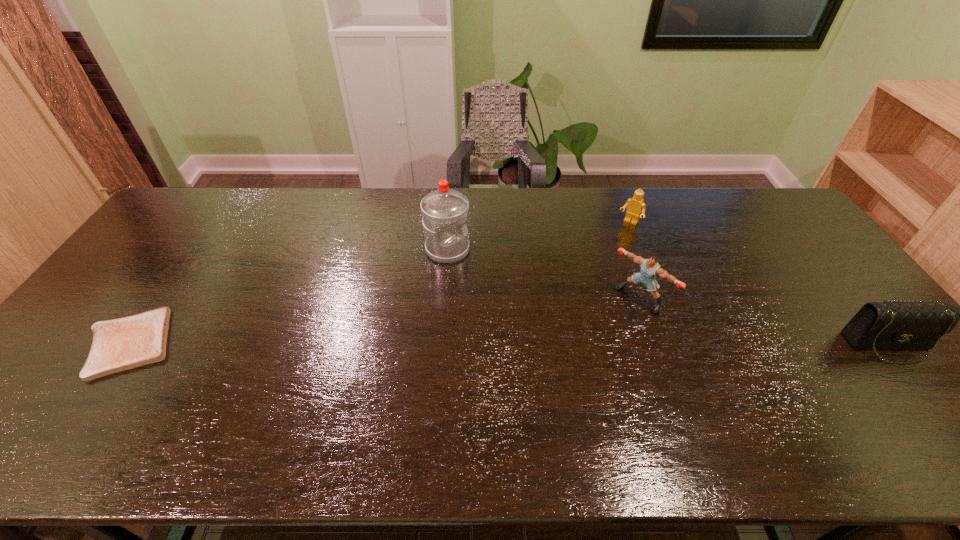
Where is `vacant space on the desktop that is between the shortest object and the clutch bag and is positioned on the front-facing side of the fourth shortest object`? vacant space on the desktop that is between the shortest object and the clutch bag and is positioned on the front-facing side of the fourth shortest object is located at coordinates (588, 344).

Find the location of a particular element. The width and height of the screenshot is (960, 540). free space on the desktop that is between the toast and the rightmost object and is positioned on the face of the farthest object is located at coordinates (540, 344).

This screenshot has width=960, height=540. I want to click on free space on the desktop that is between the toast and the rightmost object and is positioned on the handle side of the fourth nearest object, so click(x=608, y=344).